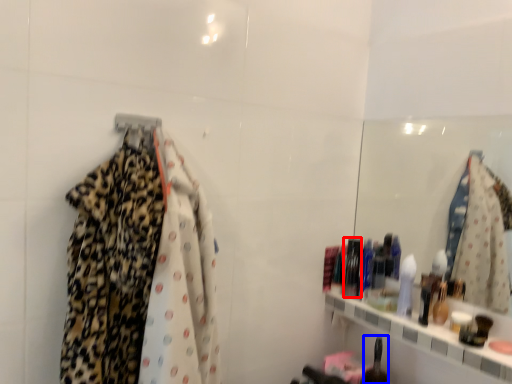
Question: Among these objects, which one is nearest to the camera, toiletry (highlighted by a red box) or toiletry (highlighted by a blue box)?

Choices:
 (A) toiletry
 (B) toiletry

Answer: (B)